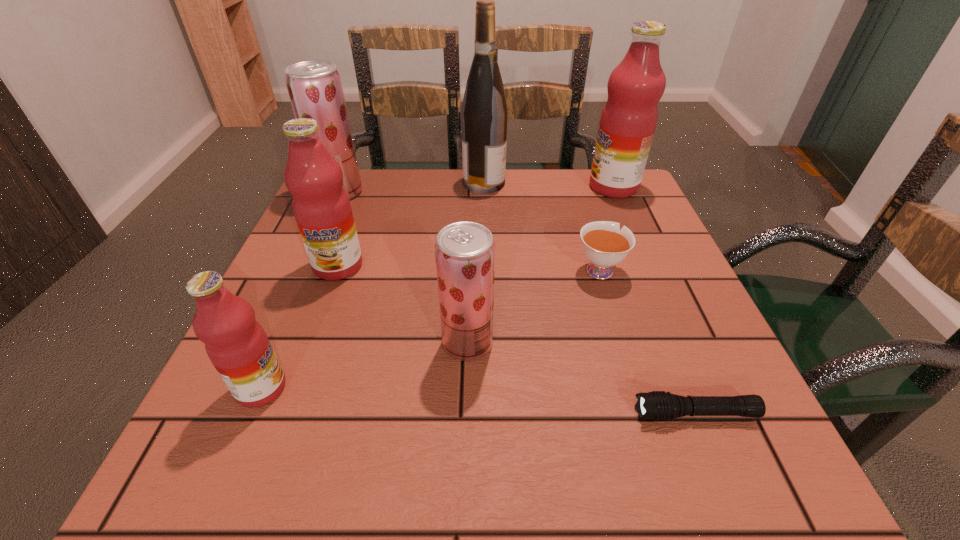
Where is `fruit juice positioned at the right edge`? The height and width of the screenshot is (540, 960). fruit juice positioned at the right edge is located at coordinates (628, 121).

This screenshot has width=960, height=540. I want to click on teacup located at the right edge, so click(x=605, y=245).

Find the location of a particular element. flashlight present at the right edge is located at coordinates (657, 405).

Identify the location of object that is at the far left corner. Image resolution: width=960 pixels, height=540 pixels. (314, 86).

The image size is (960, 540). I want to click on object that is at the far right corner, so click(628, 121).

Find the location of a particular element. object that is positioned at the near right corner is located at coordinates (657, 405).

In the image, there is a desktop. At what (x,y) coordinates should I click in order to perform the action: click on free space at the far edge. Please return your answer as a coordinate pair (x, y). Looking at the image, I should click on (442, 179).

This screenshot has width=960, height=540. Find the location of `free space at the near edge of the desktop`. free space at the near edge of the desktop is located at coordinates (591, 443).

In the image, there is a desktop. What are the coordinates of `vacant space at the left edge` in the screenshot? It's located at [x=289, y=356].

Image resolution: width=960 pixels, height=540 pixels. Identify the location of vacant point at the right edge. (647, 274).